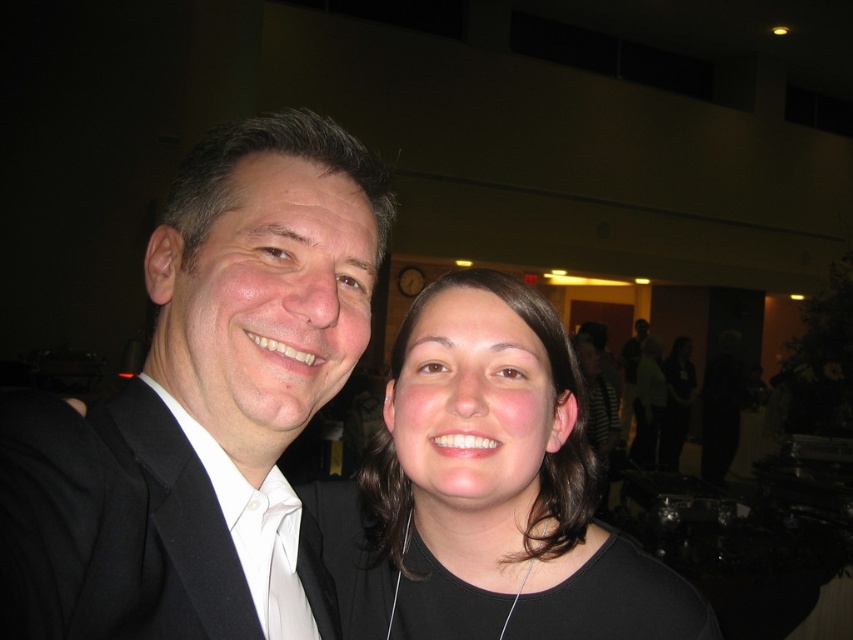
Who is taller, black matte hair at center or white satin tie at center?

With more height is black matte hair at center.

Is black matte hair at center wider than white satin tie at center?

Indeed, black matte hair at center has a greater width compared to white satin tie at center.

Locate an element on the screen. This screenshot has height=640, width=853. black matte hair at center is located at coordinates (486, 490).

The height and width of the screenshot is (640, 853). Identify the location of black matte hair at center. (486, 490).

From the picture: Is black matte hair at center closer to the viewer compared to black woolen suit at left?

No.

Which is behind, point (467, 579) or point (19, 528)?

The point (467, 579) is more distant.

Where is `black matte hair at center`? This screenshot has width=853, height=640. black matte hair at center is located at coordinates (486, 490).

Who is more forward, [16,621] or [276,563]?

Positioned in front is point [16,621].

Does black matte suit at left have a lesser width compared to white satin tie at center?

In fact, black matte suit at left might be wider than white satin tie at center.

Who is more distant from viewer, (164,410) or (265,632)?

The point (265,632) is more distant.

I want to click on black matte suit at left, so click(198, 397).